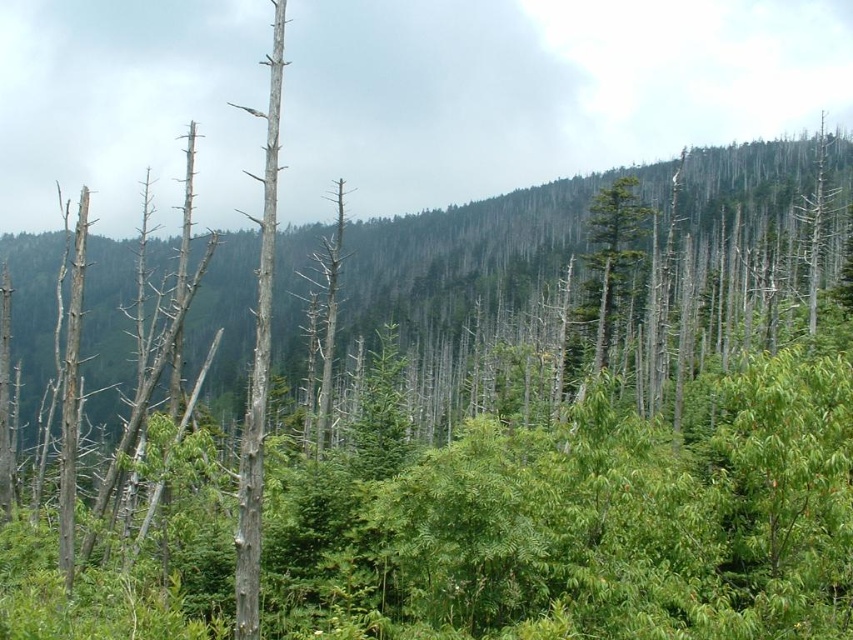
You are a hiker trying to navigate through the forest. You notice two trees at the center of your view, the green leafy trees at center and the green matte tree at center. Which tree would you need to look up higher to see the top of?

The green leafy trees at center is taller than the green matte tree at center, so you would need to look up higher to see the top of the green leafy trees at center.

Based on the scene description, where are the green leafy trees at center located in terms of coordinates?

The green leafy trees at center are located at coordinates point [460,259].